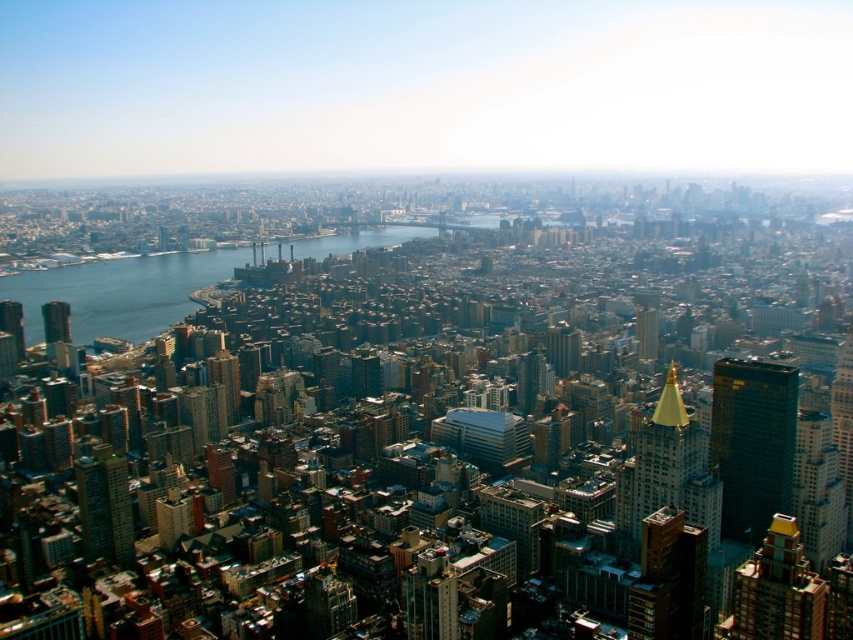
Does shiny gold skyscraper at upper right have a smaller size compared to gold metallic spire at center-right?

No, shiny gold skyscraper at upper right is not smaller than gold metallic spire at center-right.

Measure the distance between shiny gold skyscraper at upper right and gold metallic spire at center-right.

46.73 meters

This screenshot has height=640, width=853. What do you see at coordinates (752, 444) in the screenshot?
I see `shiny gold skyscraper at upper right` at bounding box center [752, 444].

The height and width of the screenshot is (640, 853). I want to click on shiny gold skyscraper at upper right, so click(x=752, y=444).

Between blue water at center and gold metallic spire at center-right, which one appears on the right side from the viewer's perspective?

Positioned to the right is gold metallic spire at center-right.

Is blue water at center shorter than gold metallic spire at center-right?

Correct, blue water at center is not as tall as gold metallic spire at center-right.

Between point (357, 244) and point (663, 428), which one is positioned in front?

Point (357, 244) is more forward.

What are the coordinates of `blue water at center` in the screenshot? It's located at (120, 291).

Does blue water at center appear over shiny gold skyscraper at upper right?

Indeed, blue water at center is positioned over shiny gold skyscraper at upper right.

Is point (73, 321) farther from viewer compared to point (775, 486)?

No.

This screenshot has width=853, height=640. Find the location of `blue water at center`. blue water at center is located at coordinates (120, 291).